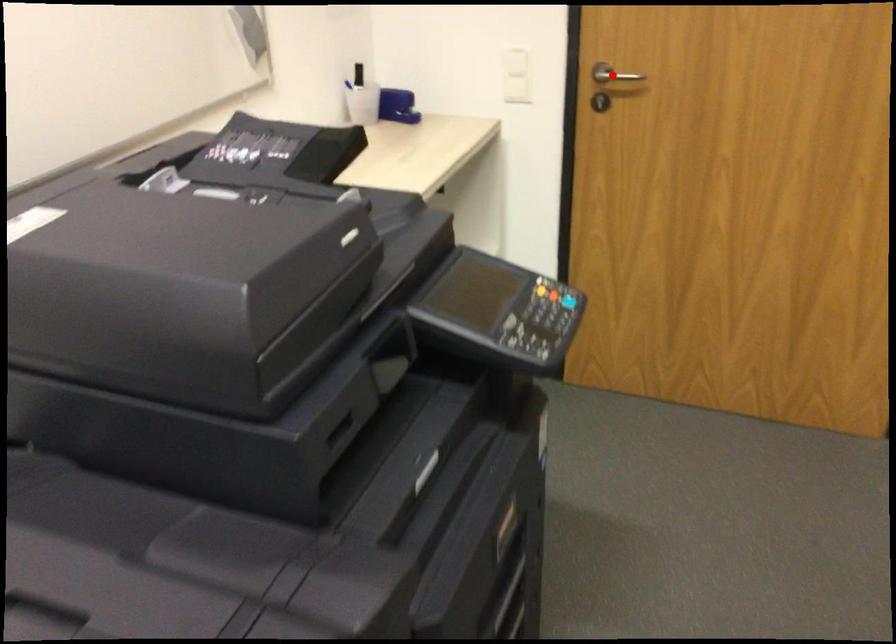
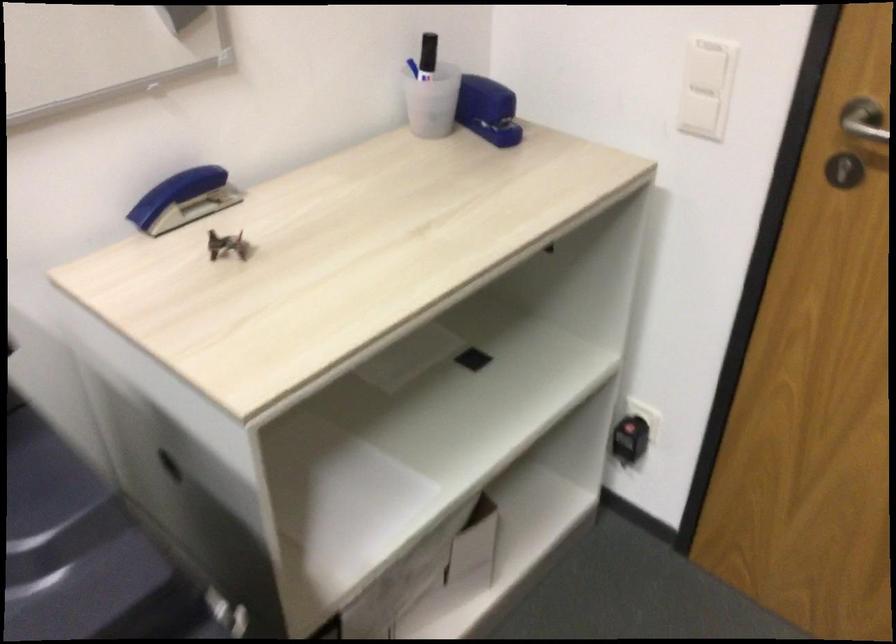
Question: I am providing you with two images of the same scene from different viewpoints. A red point is shown in image1. For the corresponding object point in image2, is it positioned nearer or farther from the camera?

Choices:
 (A) Nearer
 (B) Farther

Answer: (A)